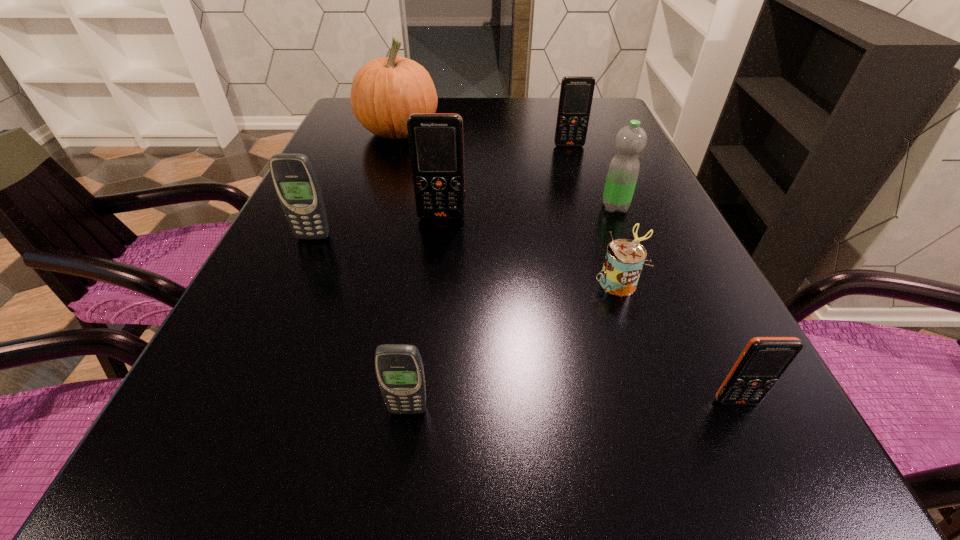
The width and height of the screenshot is (960, 540). I want to click on vacant space that is in between the second nearest orange cellular telephone and the farthest orange cellular telephone, so click(506, 181).

Locate which object ranks fourth in proximity to the nearest orange cellular telephone. Please provide its 2D coordinates. Your answer should be formatted as a tuple, i.e. [(x, y)], where the tuple contains the x and y coordinates of a point satisfying the conditions above.

[(436, 147)]

The width and height of the screenshot is (960, 540). I want to click on the fifth closest object to the shortest object, so click(576, 93).

Point out which cellular telephone is positioned as the third nearest to the pumpkin. Please provide its 2D coordinates. Your answer should be formatted as a tuple, i.e. [(x, y)], where the tuple contains the x and y coordinates of a point satisfying the conditions above.

[(294, 178)]

Select which cellular telephone is the third closest to the green water bottle. Please provide its 2D coordinates. Your answer should be formatted as a tuple, i.e. [(x, y)], where the tuple contains the x and y coordinates of a point satisfying the conditions above.

[(764, 360)]

Identify which orange cellular telephone is located as the nearest to the second smallest orange cellular telephone. Please provide its 2D coordinates. Your answer should be formatted as a tuple, i.e. [(x, y)], where the tuple contains the x and y coordinates of a point satisfying the conditions above.

[(436, 147)]

This screenshot has width=960, height=540. I want to click on orange cellular telephone that is the second closest to the tallest cellular telephone, so click(764, 360).

I want to click on free location that satisfies the following two spatial constraints: 1. on the screen of the third nearest object; 2. on the right side of the leftmost orange cellular telephone, so click(x=435, y=281).

Identify the location of free spot that satisfies the following two spatial constraints: 1. on the screen of the sixth farthest object; 2. on the right side of the second cellular telephone from right to left. (612, 281).

Find the location of a particular element. vacant area that satisfies the following two spatial constraints: 1. on the screen of the shortest object; 2. on the left side of the second orange cellular telephone from left to right is located at coordinates (612, 281).